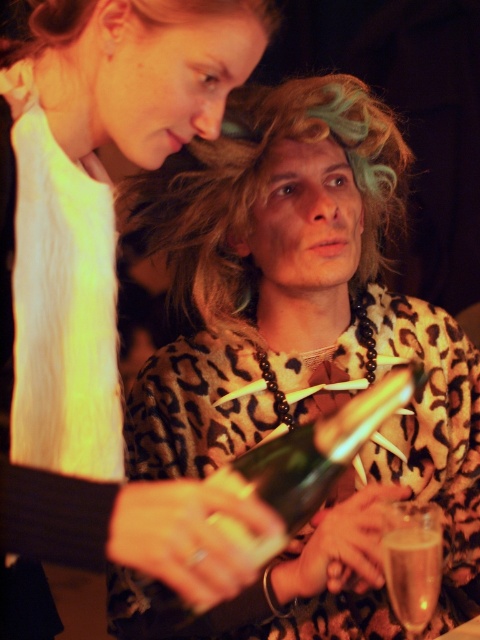
Based on the photo, does leopard print sweater at center have a greater width compared to clear glass at lower right?

Correct, the width of leopard print sweater at center exceeds that of clear glass at lower right.

Who is more forward, (269, 221) or (395, 596)?

Positioned in front is point (395, 596).

Does point (358, 355) come closer to viewer compared to point (421, 540)?

No, (358, 355) is behind (421, 540).

At what (x,y) coordinates should I click in order to perform the action: click on leopard print sweater at center. Please return your answer as a coordinate pair (x, y). The image size is (480, 640). Looking at the image, I should click on (303, 358).

Consider the image. Between leopard print sweater at center and matte white shirt at upper left, which one is positioned lower?

Positioned lower is leopard print sweater at center.

Can you confirm if leopard print sweater at center is positioned below matte white shirt at upper left?

Indeed, leopard print sweater at center is positioned under matte white shirt at upper left.

This screenshot has width=480, height=640. In order to click on leopard print sweater at center in this screenshot , I will do `click(303, 358)`.

This screenshot has width=480, height=640. What are the coordinates of `leopard print sweater at center` in the screenshot? It's located at (303, 358).

Who is higher up, matte white shirt at upper left or clear glass at lower right?

matte white shirt at upper left is higher up.

The image size is (480, 640). Identify the location of matte white shirt at upper left. (106, 241).